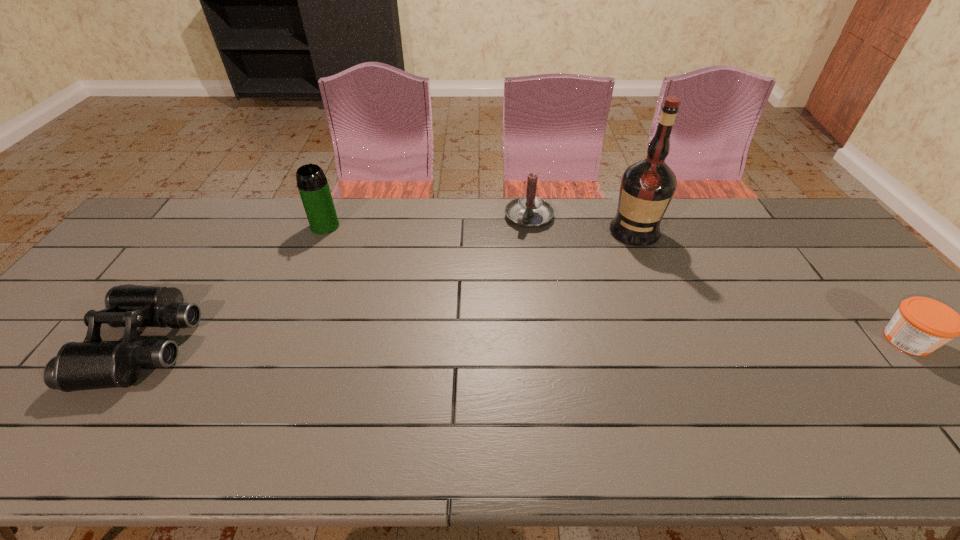
Find the location of a particular element. vacant space situated on the front-facing side of the leftmost object is located at coordinates (66, 344).

This screenshot has height=540, width=960. I want to click on vacant region located 0.200m from the spout of the thermos bottle, so click(364, 265).

Identify the location of free region located from the spout of the thermos bottle. (386, 286).

This screenshot has height=540, width=960. I want to click on blank space located 0.060m from the spout of the thermos bottle, so click(341, 242).

I want to click on free region located 0.200m on the surface of the liquor, so click(x=620, y=289).

Locate an element on the screen. This screenshot has height=540, width=960. free spot located 0.350m on the surface of the liquor is located at coordinates (612, 328).

The image size is (960, 540). I want to click on free location located on the surface of the liquor, so click(x=612, y=325).

The height and width of the screenshot is (540, 960). Identify the location of vacant area located on the side of the candle with the handle loop. 511,249.

In order to click on vacant space situated on the side of the candle with the handle loop in this screenshot , I will do `click(486, 292)`.

At what (x,y) coordinates should I click in order to perform the action: click on vacant space located 0.230m on the side of the candle with the handle loop. Please return your answer as a coordinate pair (x, y). Image resolution: width=960 pixels, height=540 pixels. Looking at the image, I should click on (493, 279).